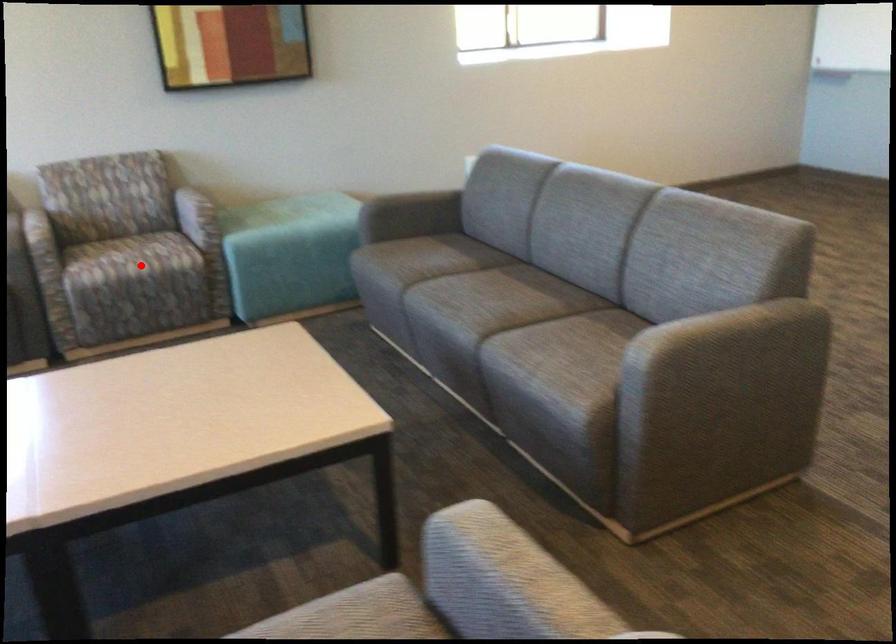
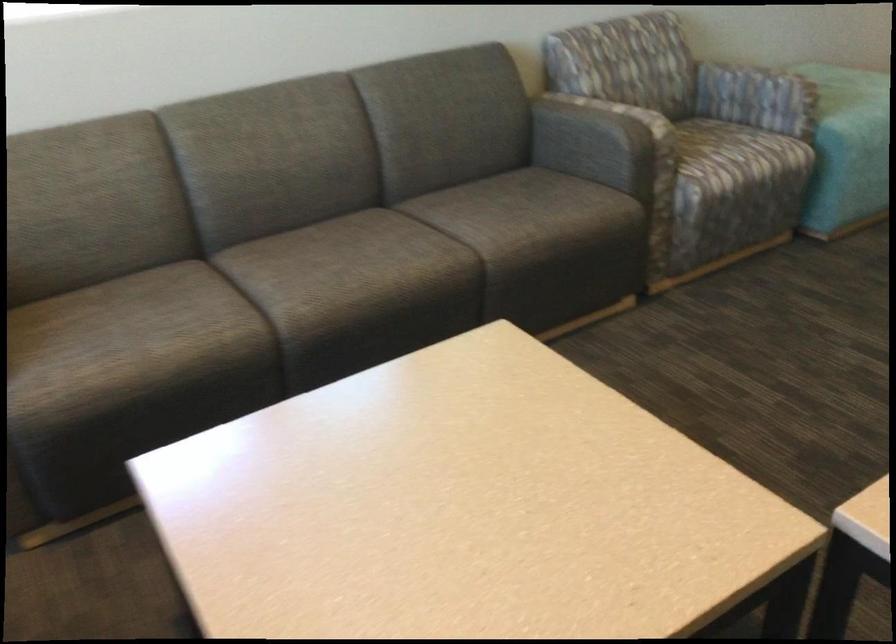
In the second image, find the point that corresponds to the highlighted location in the first image.

(737, 155)